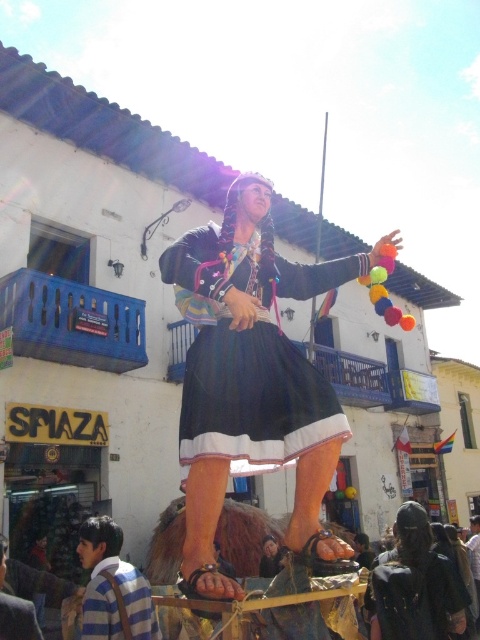
Which is more to the left, matte black dress at center or striped cotton shirt at lower left?

striped cotton shirt at lower left is more to the left.

Is point (398, 593) behind point (109, 582)?

Yes, it is.

At what (x,y) coordinates should I click in order to perform the action: click on matte black dress at center. Please return your answer as a coordinate pair (x, y). The image size is (480, 640). Looking at the image, I should click on (415, 586).

Is black satin dress at center behind striped shirt at lower left?

Yes.

Does black satin dress at center appear on the left side of striped shirt at lower left?

No, black satin dress at center is not to the left of striped shirt at lower left.

Is point (219, 426) positioned behind point (36, 634)?

No, it is in front of (36, 634).

Image resolution: width=480 pixels, height=640 pixels. What are the coordinates of `black satin dress at center` in the screenshot? It's located at (242, 369).

In the scene shown: Between black satin dress at center and matte black dress at center, which one has less height?

black satin dress at center is shorter.

Is point (251, 465) in front of point (389, 596)?

Yes, it is.

Does point (205, 236) come closer to viewer compared to point (380, 602)?

Yes, it is.

Identify the location of black satin dress at center. (242, 369).